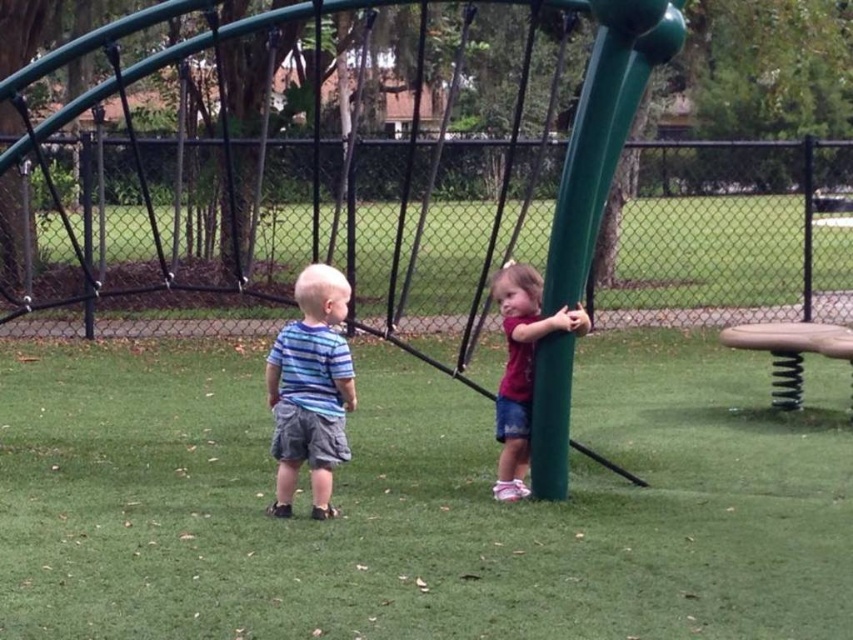
You are a photographer trying to capture both the blue striped shirt at left and the matte green pole at right in the same frame. Based on their sizes, which object should you focus on to ensure both fit clearly in the photo?

Since the blue striped shirt at left is larger in size than the matte green pole at right, you should focus on the blue striped shirt at left to ensure both objects fit clearly in the photo.

You are a parent supervising children at the playground. You see the blue striped shirt at left and the matte green pole at right. Which child is closer to the pole?

The child wearing the blue striped shirt at left is closer to the matte green pole at right since the blue striped shirt at left is positioned to the left of the matte green pole at right.